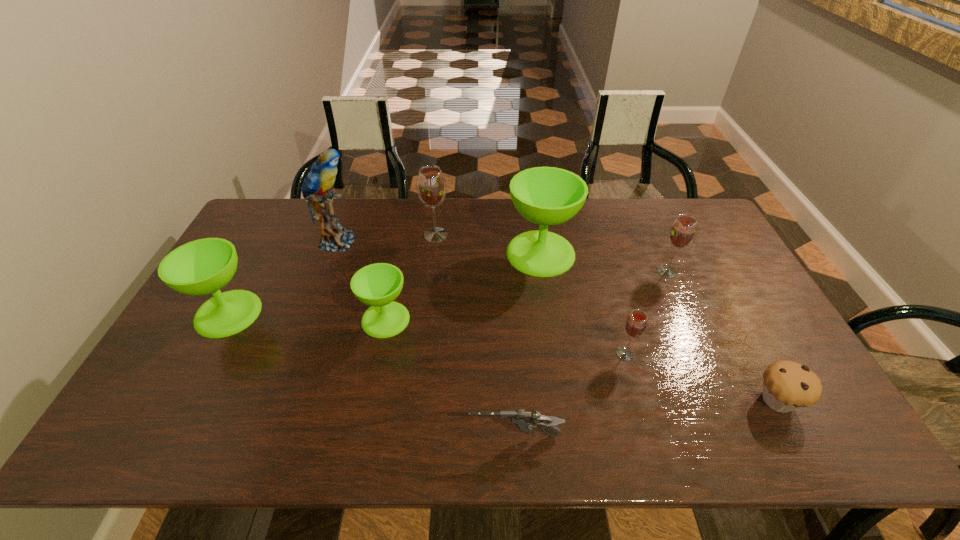
This screenshot has width=960, height=540. I want to click on object that is at the left edge, so click(x=204, y=266).

Where is `object that is at the right edge`? The image size is (960, 540). object that is at the right edge is located at coordinates (787, 386).

Locate an element on the screen. object located at the near right corner is located at coordinates (787, 386).

Find the location of `free space at the far edge of the desktop`. free space at the far edge of the desktop is located at coordinates (649, 231).

The image size is (960, 540). I want to click on free region at the near edge, so click(x=519, y=445).

Identify the location of vacant region at the left edge of the desktop. This screenshot has width=960, height=540. (180, 343).

The image size is (960, 540). Identify the location of vacant space at the right edge. (697, 260).

In the image, there is a desktop. At what (x,y) coordinates should I click in order to perform the action: click on free space at the far left corner. Please return your answer as a coordinate pair (x, y). Image resolution: width=960 pixels, height=540 pixels. Looking at the image, I should click on (292, 211).

This screenshot has height=540, width=960. In order to click on vacant region at the near left corner of the desktop in this screenshot , I will do `click(178, 449)`.

Image resolution: width=960 pixels, height=540 pixels. I want to click on free space between the gun and the seventh farthest object, so click(570, 395).